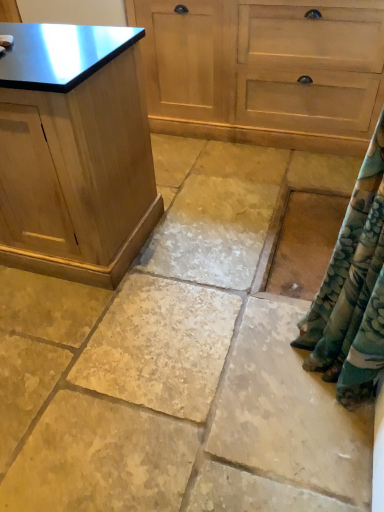
Describe the element at coordinates (264, 71) in the screenshot. I see `light wood cabinet at center` at that location.

At what (x,y) coordinates should I click in order to perform the action: click on light wood cabinet at center. Please return your answer as a coordinate pair (x, y). The height and width of the screenshot is (512, 384). Looking at the image, I should click on (264, 71).

This screenshot has height=512, width=384. I want to click on light wood cabinet at center, so click(264, 71).